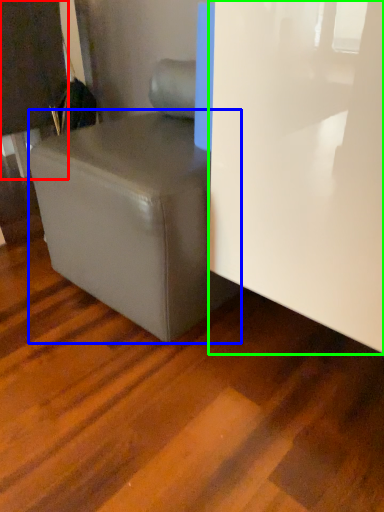
Question: Which object is the closest to the furniture (highlighted by a red box)? Choose among these: table (highlighted by a blue box) or glass door (highlighted by a green box).

Choices:
 (A) table
 (B) glass door

Answer: (A)